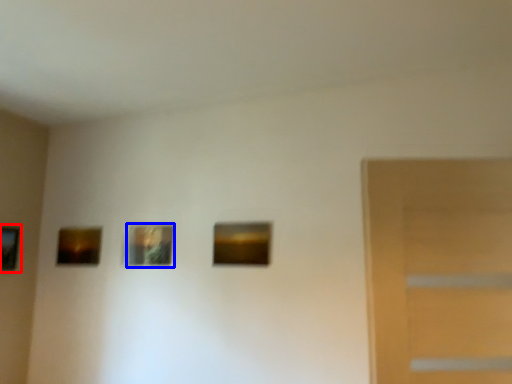
Question: Among these objects, which one is farthest to the camera, picture frame (highlighted by a red box) or picture frame (highlighted by a blue box)?

Choices:
 (A) picture frame
 (B) picture frame

Answer: (B)